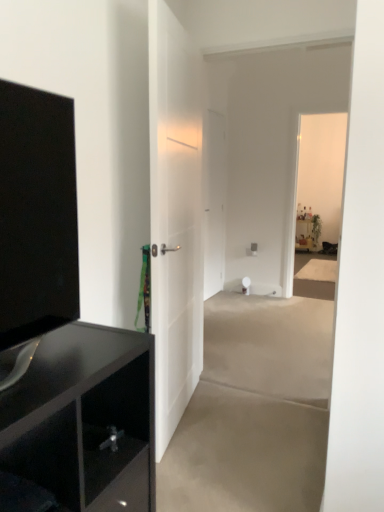
Question: From a real-world perspective, is gray matte concrete at center, which ranks as the 2th concrete in top-to-bottom order, positioned above or below white glossy door at center, marked as the first door in a back-to-front arrangement?

Choices:
 (A) above
 (B) below

Answer: (B)

Question: Does point (297, 463) appear closer or farther from the camera than point (208, 150)?

Choices:
 (A) farther
 (B) closer

Answer: (B)

Question: Estimate the real-world distances between objects in this image. Which object is closer to the smooth beige carpet at center, the second concrete from the front?

Choices:
 (A) gray matte concrete at center, which ranks as the 2th concrete in top-to-bottom order
 (B) glossy black cabinet at left
 (C) matte black tv at left
 (D) white glossy door at center, marked as the first door in a back-to-front arrangement
 (E) white matte toilet paper at center

Answer: (A)

Question: Which of these objects is positioned farthest from the smooth beige carpet at center, which ranks as the 2th concrete in bottom-to-top order?

Choices:
 (A) glossy black cabinet at left
 (B) white matte door at center, acting as the second door starting from the right
 (C) gray matte concrete at center, marked as the 1th concrete in a bottom-to-top arrangement
 (D) matte black tv at left
 (E) white glossy door at center, which ranks as the 2th door in front-to-back order

Answer: (D)